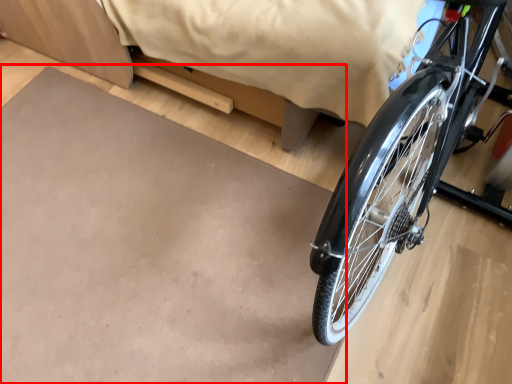
Question: Observing the image, what is the correct spatial positioning of slate (annotated by the red box) in reference to bed?

Choices:
 (A) left
 (B) right

Answer: (A)